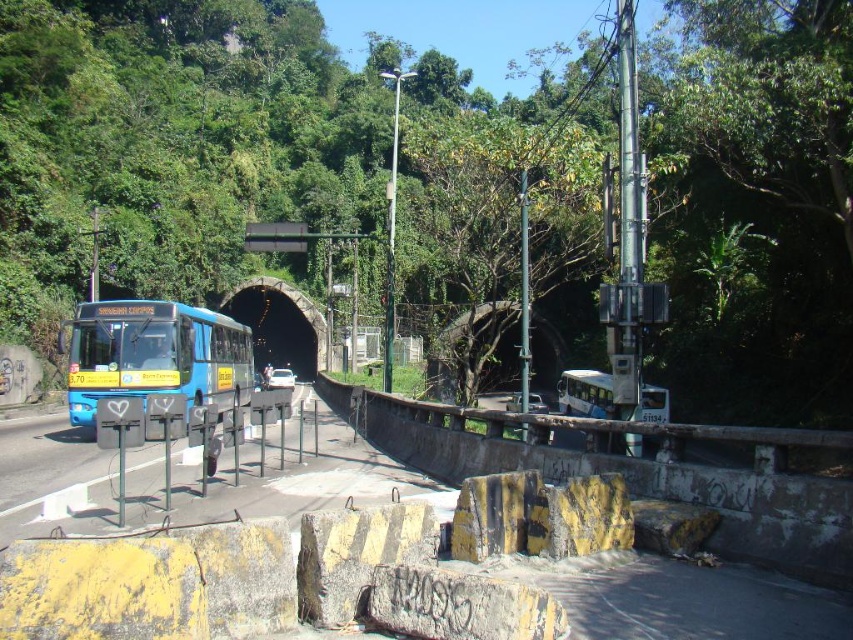
The height and width of the screenshot is (640, 853). Describe the element at coordinates (624, 477) in the screenshot. I see `yellow painted concrete barrier at lower center` at that location.

Which is in front, point (746, 488) or point (291, 298)?

Point (746, 488)

Does point (492, 451) come behind point (317, 321)?

No, (492, 451) is closer to viewer.

At what (x,y) coordinates should I click in order to perform the action: click on yellow painted concrete barrier at lower center. Please return your answer as a coordinate pair (x, y). Image resolution: width=853 pixels, height=640 pixels. Looking at the image, I should click on (624, 477).

Locate an element on the screen. The width and height of the screenshot is (853, 640). blue matte bus at left is located at coordinates (155, 355).

Does blue matte bus at left have a smaller size compared to black concrete tunnel at center?

No.

Is point (94, 413) positioned before point (236, 305)?

Yes, point (94, 413) is closer to viewer.

Locate an element on the screen. The height and width of the screenshot is (640, 853). blue matte bus at left is located at coordinates (155, 355).

Is yellow painted concrete barrier at lower center closer to camera compared to blue matte bus at left?

That is True.

Looking at this image, between yellow painted concrete barrier at lower center and blue matte bus at left, which one appears on the right side from the viewer's perspective?

yellow painted concrete barrier at lower center is more to the right.

Identify the location of yellow painted concrete barrier at lower center. The image size is (853, 640). (624, 477).